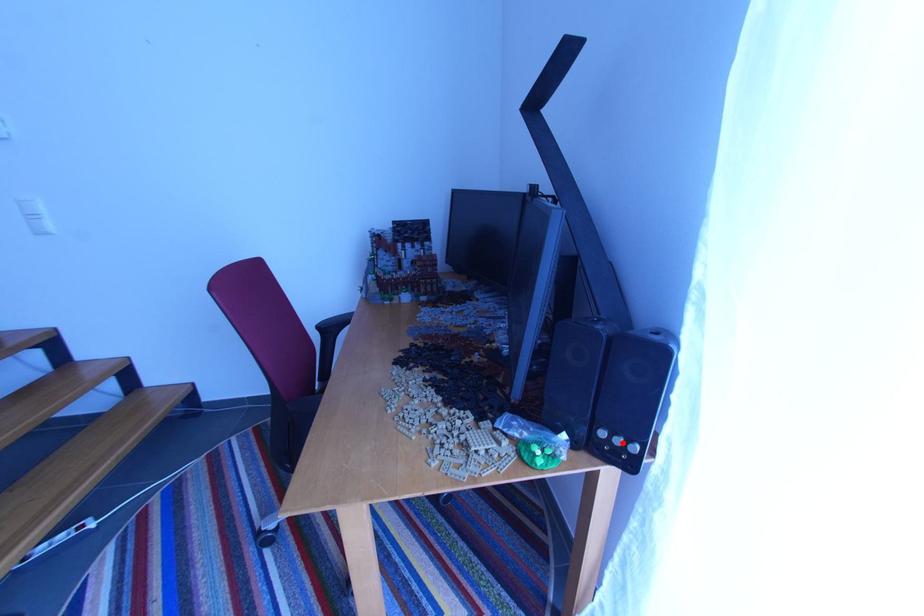
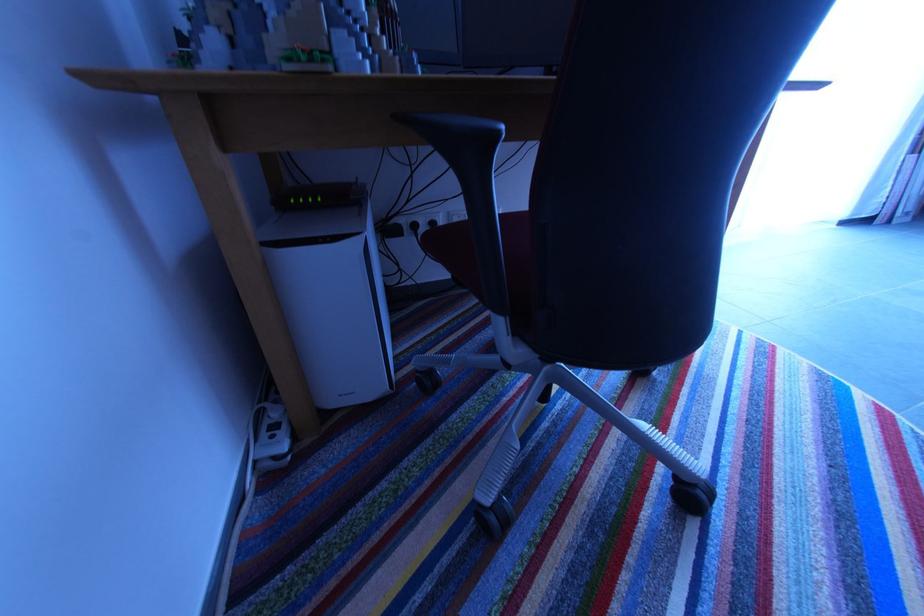
Question: I am providing you with two images of the same scene from different viewpoints. A red point is marked on the first image. Is the red point's position out of view in image 2?

Choices:
 (A) Yes
 (B) No

Answer: (A)